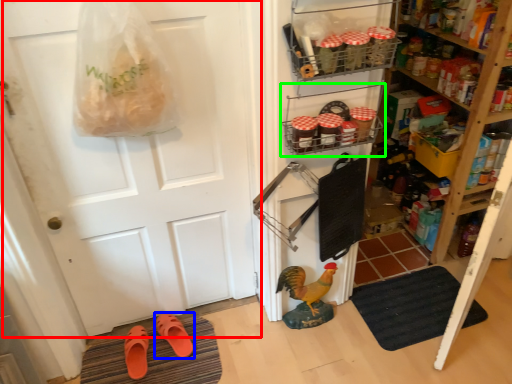
Question: Based on their relative distances, which object is farther from door (highlighted by a red box)? Choose from footwear (highlighted by a blue box) and shelf (highlighted by a green box).

Choices:
 (A) footwear
 (B) shelf

Answer: (A)